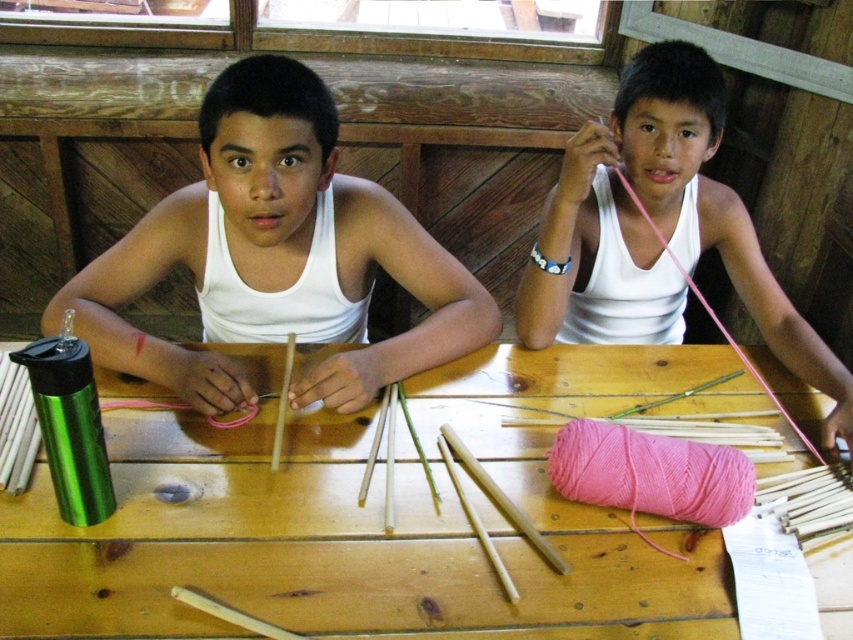
You are a photographer trying to capture a closeup of the pink matte yarn at upper right. However, the white matte tank top at center is blocking your view. Can you adjust your position to see the yarn without moving any objects?

The white matte tank top at center is in front of the pink matte yarn at upper right, so you can move your camera to the side or angle it so that you can see around the tank top to capture the yarn without moving anything.

What are the coordinates of the white matte tank top at center?

The white matte tank top at center is located at coordinates point (277, 250).

You are standing in front of the wooden table at center and want to place a 30 inch long ruler on it. Will the ruler fit entirely on the table?

The wooden table at center is 33.45 inches away from viewer, so the distance from the viewer to the table does not affect the ruler fitting on the table. The question about the ruler fitting requires knowing the table dimensions, which are not provided in the Objects Description. Therefore, it cannot be determined if the ruler will fit based on the given information.